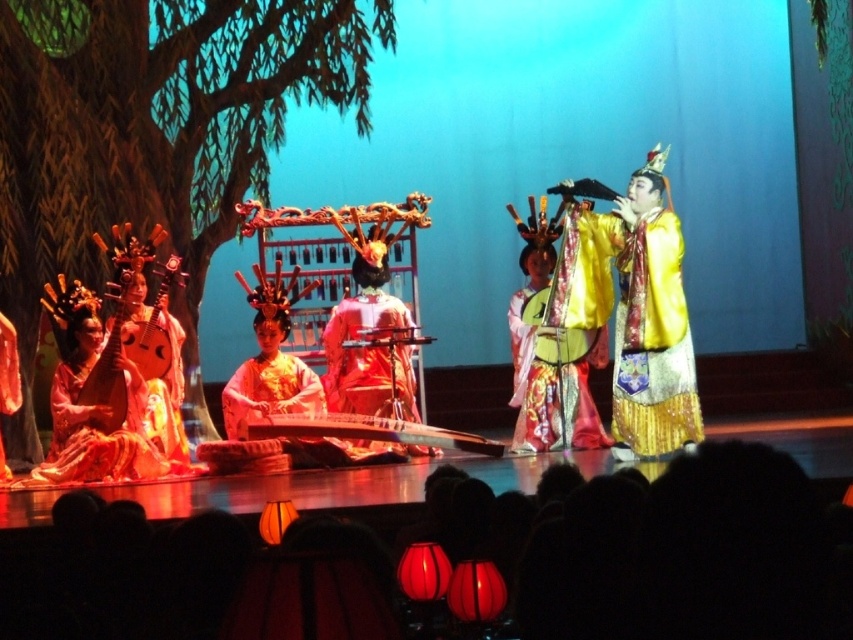
You are a stagehand preparing for a costume change. You need to quickly access the shiny gold dress at lower left and the yellow satin robe at right. Which costume is closer to you based on their positions?

The shiny gold dress at lower left is behind the yellow satin robe at right, so the yellow satin robe at right is closer to you.